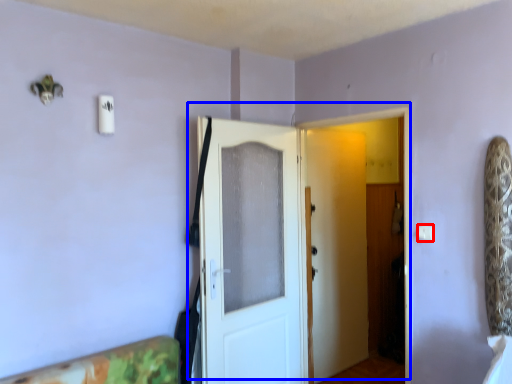
Question: Which point is closer to the camera, light switch (highlighted by a red box) or door (highlighted by a blue box)?

Choices:
 (A) light switch
 (B) door

Answer: (A)